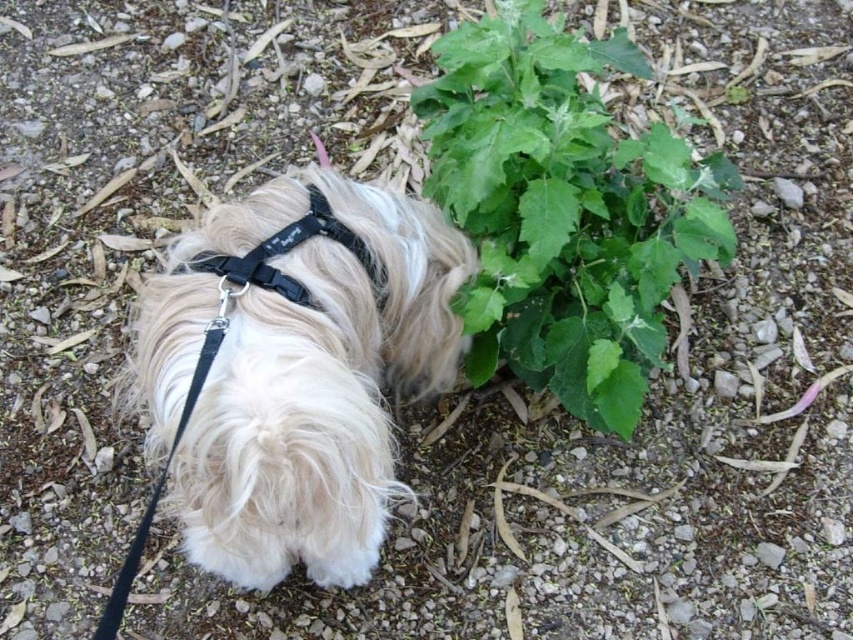
Question: Observing the image, what is the correct spatial positioning of white fluffy dog at center in reference to green leafy plant at center?

Choices:
 (A) above
 (B) below

Answer: (B)

Question: Which object appears farthest from the camera in this image?

Choices:
 (A) green leafy plant at center
 (B) white fluffy dog at center

Answer: (A)

Question: Among these points, which one is nearest to the camera?

Choices:
 (A) (604, 241)
 (B) (453, 344)

Answer: (B)

Question: Is white fluffy dog at center wider than green leafy plant at center?

Choices:
 (A) no
 (B) yes

Answer: (A)

Question: Does white fluffy dog at center have a greater width compared to green leafy plant at center?

Choices:
 (A) yes
 (B) no

Answer: (B)

Question: Which of the following is the closest to the observer?

Choices:
 (A) (437, 248)
 (B) (648, 355)

Answer: (A)